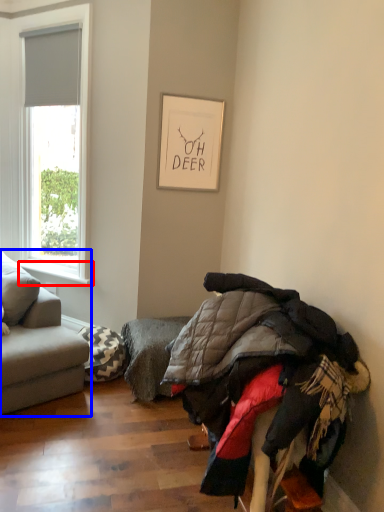
Question: Which of the following is the farthest to the observer, window sill (highlighted by a red box) or studio couch (highlighted by a blue box)?

Choices:
 (A) window sill
 (B) studio couch

Answer: (A)